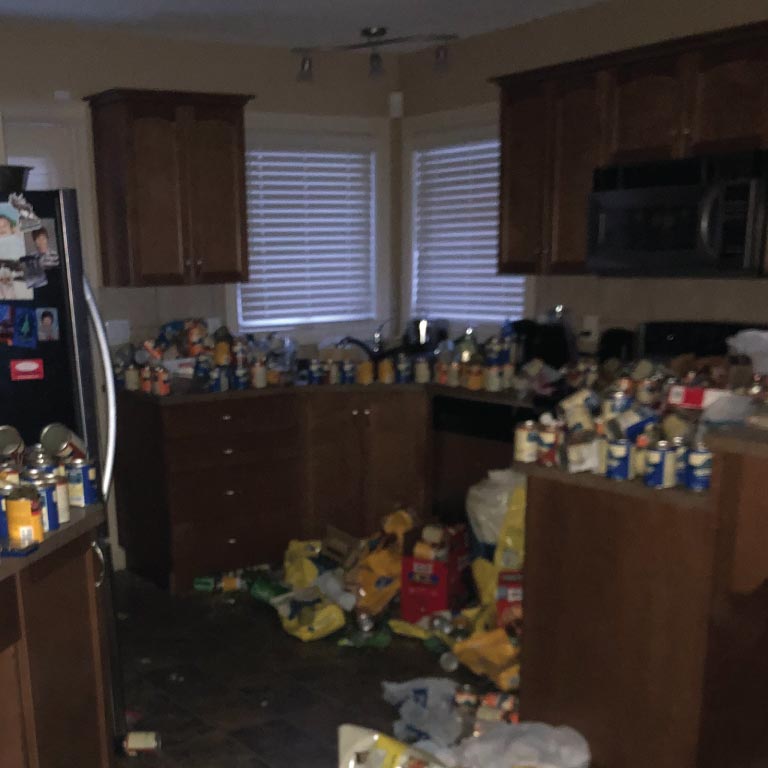
What are the coordinates of `door handle for refrigerator` in the screenshot? It's located at (117, 396).